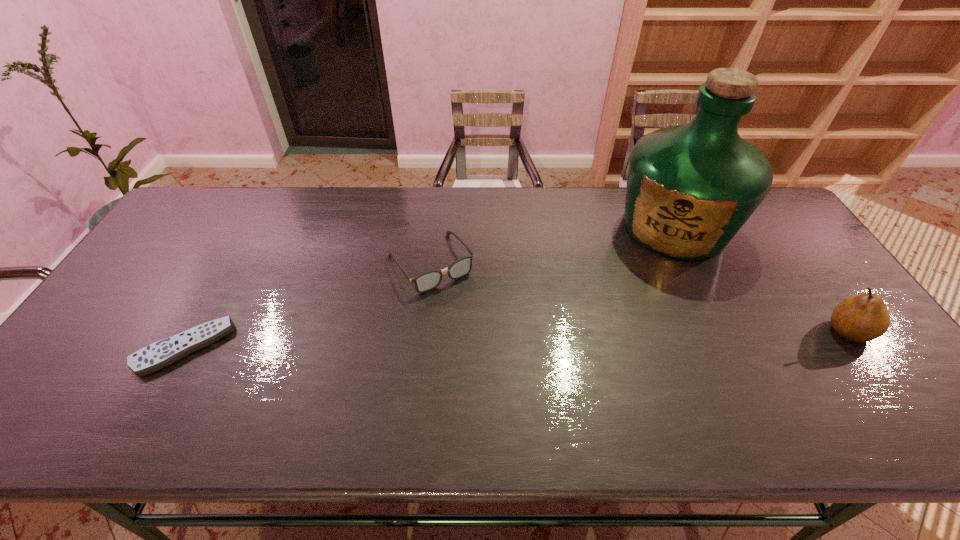
You are a GUI agent. You are given a task and a screenshot of the screen. Output one action in this format:
    pyautogui.click(x=<x>, y=<y>)
    Task: Click on the vacant region that satisfies the following two spatial constraints: 1. on the back side of the second object from left to right; 2. on the left side of the shortest object
    The image size is (960, 540).
    Given the screenshot: What is the action you would take?
    pyautogui.click(x=231, y=263)